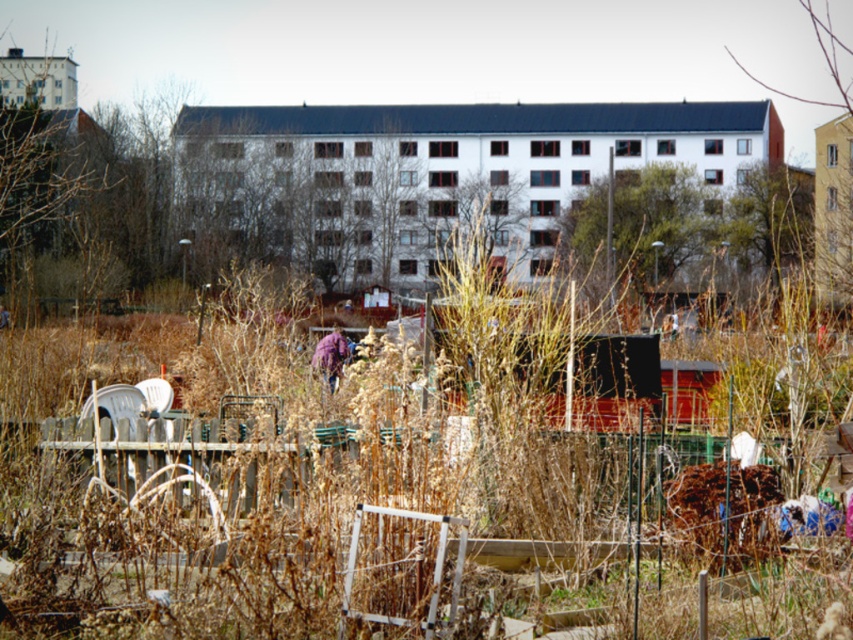
You are a gardener who needs to sit down. You see a white plastic chair at center and a purple fabric at center. Which object is shorter and more suitable for sitting?

The white plastic chair at center is shorter than the purple fabric at center, making it more suitable for sitting.

You are a gardener who needs to move the white plastic chair at center and the purple fabric at center to make space for a new plant bed. Which object requires more horizontal space to move aside?

The purple fabric at center requires more horizontal space to move aside because it is wider than the white plastic chair at center.